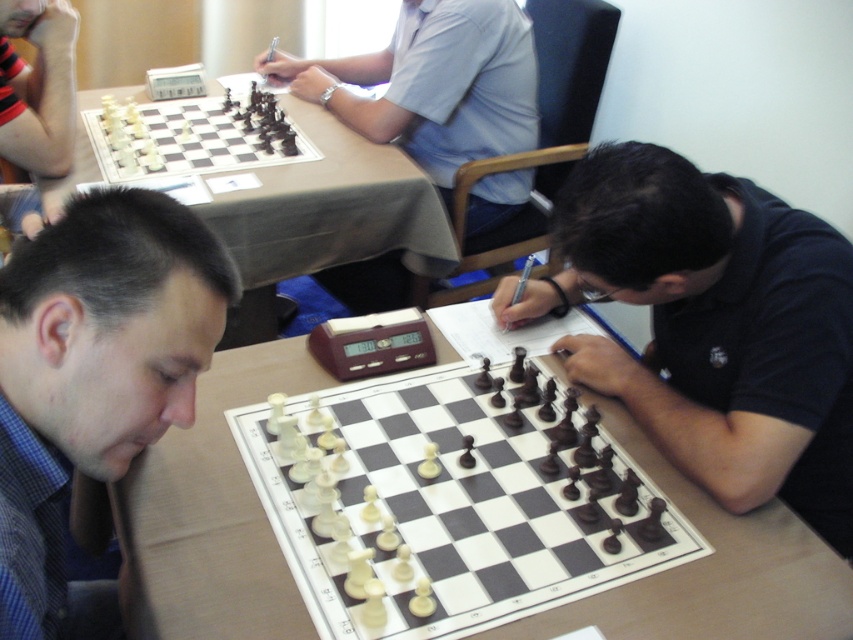
You are sitting at the wooden table at center and want to pass a note to the player wearing the dark blue shirt at right. In which direction should you pass it?

The dark blue shirt at right is positioned on the right side of the wooden table at center, so you should pass the note to the right side.

You are a photographer standing 1.2 meters away from the chessboard. You want to take a photo of the point at coordinates point (x=740, y=480). Will you need to move closer or farther away to focus on that point?

The distance of point (x=740, y=480) from camera is 1.10 meters. Since you are currently 1.2 meters away, you need to move closer by 0.1 meters to focus on that point.

You are a photographer trying to capture a closeup of the dark blue shirt at right and the wooden chessboard at center. Based on their sizes, which object should you zoom in on first to ensure both are in focus?

The dark blue shirt at right has a lesser width compared to the wooden chessboard at center, so you should zoom in on the wooden chessboard at center first to ensure both are in focus.